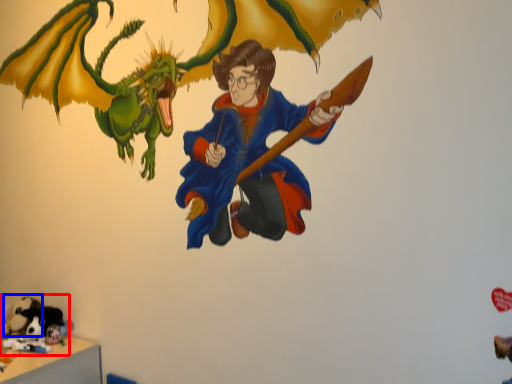
Question: Which point is further to the camera, toy (highlighted by a red box) or animal (highlighted by a blue box)?

Choices:
 (A) toy
 (B) animal

Answer: (B)